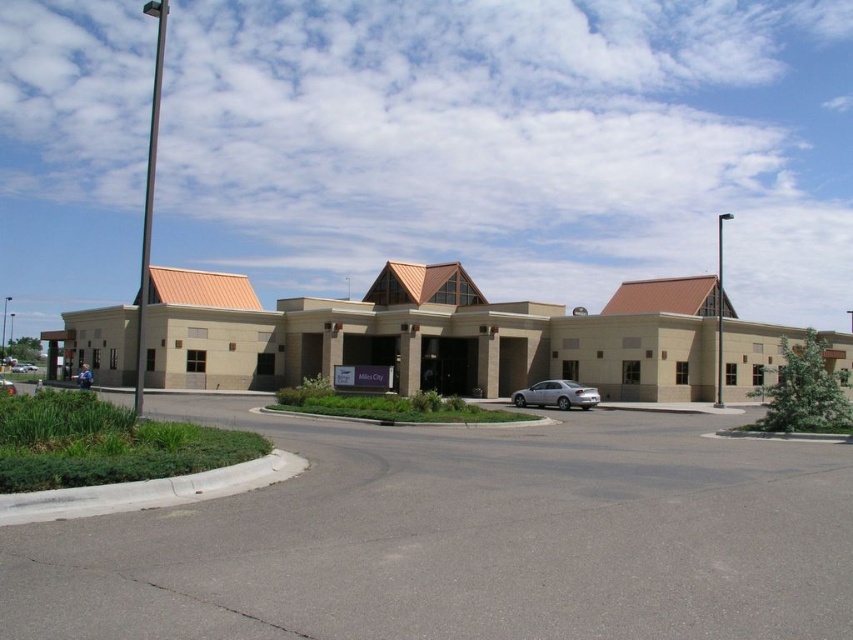
You are standing in front of the beige concrete building at center and want to walk to the silver metallic sedan at center. Which direction should you move relative to the building?

Since the beige concrete building at center is closer to you than the silver metallic sedan at center, you should move away from the building towards the sedan.

You are standing in front of the modern building and want to locate two specific points marked on the image. The first point is at coordinates point [686,449] and the second is at point [512,326]. Which of these two points is nearer to you?

Point [686,449] is closer to the viewer than point [512,326].